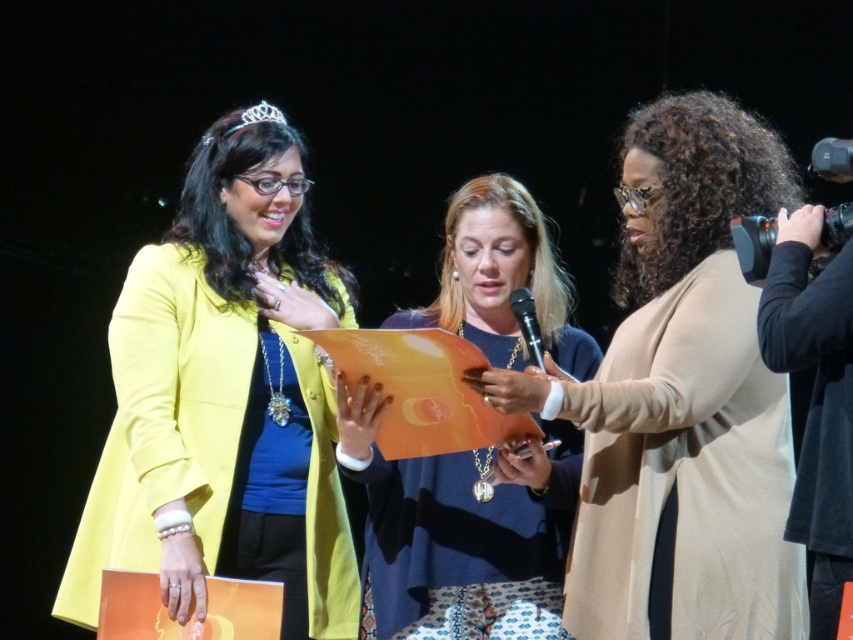
You are standing at the origin point of the coordinate system in the image. You want to move towards the beige fabric coat at center. In which direction should you move based on its coordinates?

The beige fabric coat at center is located at coordinates point (682, 400), so you should move towards the right and upward from your current position at the origin to reach it.

Based on the photo, you are a photographer at the event and need to capture a clear photo of both the beige fabric coat at center and the matte orange paper at center. Which object will appear closer to the camera in the photo?

The beige fabric coat at center is in front of the matte orange paper at center, so it will appear closer to the camera in the photo.